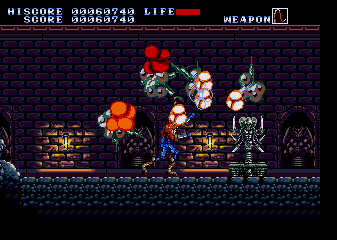
Where is `lantern`? The width and height of the screenshot is (337, 240). lantern is located at coordinates (209, 142), (65, 139).